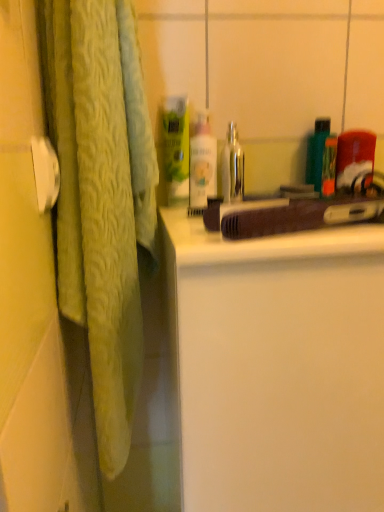
Describe the element at coordinates (277, 366) in the screenshot. Image resolution: width=384 pixels, height=512 pixels. I see `white matte cabinet at center` at that location.

What is the approximate width of shiny metallic faucet at center?

The width of shiny metallic faucet at center is 2.41 inches.

Locate an element on the screen. The width and height of the screenshot is (384, 512). shiny metallic faucet at center is located at coordinates (232, 167).

This screenshot has width=384, height=512. Describe the element at coordinates (215, 242) in the screenshot. I see `brown matte hairdryer at center` at that location.

Locate an element on the screen. Image resolution: width=384 pixels, height=512 pixels. brown matte hairdryer at center is located at coordinates (215, 242).

Where is `white matte cabinet at center`? The width and height of the screenshot is (384, 512). white matte cabinet at center is located at coordinates (277, 366).

Find the location of `bathroom cabinet directly beneath the green matte bottle at center (from a real-world perspective)`. bathroom cabinet directly beneath the green matte bottle at center (from a real-world perspective) is located at coordinates (277, 366).

Which is correct: white matte cabinet at center is inside green matte bottle at center, or outside of it?

white matte cabinet at center is not inside green matte bottle at center, it's outside.

Between point (205, 291) and point (167, 150), which one is positioned behind?

Point (167, 150)

How different are the orientations of white matte cabinet at center and green matte bottle at center in degrees?

The facing directions of white matte cabinet at center and green matte bottle at center are 6.66e-05 degrees apart.

Which is in front, brown matte hairdryer at center or shiny metallic faucet at center?

brown matte hairdryer at center is more forward.

Is brown matte hairdryer at center thinner than shiny metallic faucet at center?

No.

From the image's perspective, who appears lower, brown matte hairdryer at center or shiny metallic faucet at center?

brown matte hairdryer at center appears lower in the image.

Considering the relative sizes of brown matte hairdryer at center and shiny metallic faucet at center in the image provided, is brown matte hairdryer at center smaller than shiny metallic faucet at center?

No.

Considering the points (252, 206) and (280, 275), which point is in front, point (252, 206) or point (280, 275)?

Point (280, 275)

Which is more to the left, brown matte hairdryer at center or white matte cabinet at center?

From the viewer's perspective, brown matte hairdryer at center appears more on the left side.

From a real-world perspective, who is located lower, brown matte hairdryer at center or white matte cabinet at center?

white matte cabinet at center, from a real-world perspective.

Choose the correct answer: Is brown matte hairdryer at center inside white matte cabinet at center or outside it?

brown matte hairdryer at center is not inside white matte cabinet at center, it's outside.

Is white matte cabinet at center positioned with its back to shiny metallic faucet at center?

white matte cabinet at center does not have its back to shiny metallic faucet at center.

Consider the image. What's the angular difference between white matte cabinet at center and shiny metallic faucet at center's facing directions?

The angle between the facing direction of white matte cabinet at center and the facing direction of shiny metallic faucet at center is 3.25e-05 degrees.

Considering the positions of objects white matte cabinet at center and shiny metallic faucet at center in the image provided, who is more to the left, white matte cabinet at center or shiny metallic faucet at center?

shiny metallic faucet at center.

Which is correct: white matte cabinet at center is inside shiny metallic faucet at center, or outside of it?

white matte cabinet at center is spatially situated outside shiny metallic faucet at center.

Considering the sizes of objects shiny metallic faucet at center and white glossy lotion at center in the image provided, who is bigger, shiny metallic faucet at center or white glossy lotion at center?

With larger size is white glossy lotion at center.

Is shiny metallic faucet at center wider than white glossy lotion at center?

Correct, the width of shiny metallic faucet at center exceeds that of white glossy lotion at center.

Identify the location of toiletry lying in front of the shiny metallic faucet at center. (201, 163).

Based on the photo, is shiny metallic faucet at center not within white glossy lotion at center?

Absolutely, shiny metallic faucet at center is external to white glossy lotion at center.

Which is in front, shiny metallic faucet at center or brown matte hairdryer at center?

brown matte hairdryer at center is more forward.

How distant is shiny metallic faucet at center from brown matte hairdryer at center?

shiny metallic faucet at center and brown matte hairdryer at center are 7.88 inches apart from each other.

Considering the sizes of objects shiny metallic faucet at center and brown matte hairdryer at center in the image provided, who is thinner, shiny metallic faucet at center or brown matte hairdryer at center?

Thinner between the two is shiny metallic faucet at center.

From the picture: From the image's perspective, who appears lower, shiny metallic faucet at center or brown matte hairdryer at center?

brown matte hairdryer at center, from the image's perspective.

Is point (170, 106) farther from viewer compared to point (238, 150)?

No.

Identify the location of cleaning product that appears above the shiny metallic faucet at center (from a real-world perspective). The width and height of the screenshot is (384, 512). (175, 147).

Between green matte bottle at center and shiny metallic faucet at center, which one has larger width?

With larger width is shiny metallic faucet at center.

Are green matte bottle at center and shiny metallic faucet at center making contact?

Yes, green matte bottle at center is right next to shiny metallic faucet at center and making contact.

This screenshot has height=512, width=384. Find the location of `bathroom cabinet located on the right of green matte bottle at center`. bathroom cabinet located on the right of green matte bottle at center is located at coordinates (277, 366).

Where is `faucet located on the left of brown matte hairdryer at center`? faucet located on the left of brown matte hairdryer at center is located at coordinates (232, 167).

Looking at the image, which one is located further to white matte cabinet at center, white glossy lotion at center or shiny metallic faucet at center?

shiny metallic faucet at center is further to white matte cabinet at center.

Estimate the real-world distances between objects in this image. Which object is further from shiny metallic faucet at center, white glossy lotion at center or green matte bottle at center?

green matte bottle at center is further to shiny metallic faucet at center.

Which object lies further to the anchor point green matte bottle at center, shiny metallic faucet at center or white matte cabinet at center?

white matte cabinet at center is further to green matte bottle at center.

Looking at this image, looking at the image, which one is located further to white glossy lotion at center, white matte cabinet at center or green matte bottle at center?

The object further to white glossy lotion at center is white matte cabinet at center.

Based on their spatial positions, is shiny metallic faucet at center or white glossy lotion at center further from green matte bottle at center?

shiny metallic faucet at center lies further to green matte bottle at center than the other object.

Looking at the image, which one is located closer to shiny metallic faucet at center, brown matte hairdryer at center or white glossy lotion at center?

Based on the image, white glossy lotion at center appears to be nearer to shiny metallic faucet at center.

Consider the image. Estimate the real-world distances between objects in this image. Which object is closer to white matte cabinet at center, shiny metallic faucet at center or white glossy lotion at center?

white glossy lotion at center is closer to white matte cabinet at center.

Estimate the real-world distances between objects in this image. Which object is closer to white matte cabinet at center, white glossy lotion at center or green matte bottle at center?

The object closer to white matte cabinet at center is white glossy lotion at center.

At what (x,y) coordinates should I click in order to perform the action: click on cleaning product between brown matte hairdryer at center and white glossy lotion at center from front to back. Please return your answer as a coordinate pair (x, y). The height and width of the screenshot is (512, 384). Looking at the image, I should click on (175, 147).

Find the location of a particular element. Image resolution: width=384 pixels, height=512 pixels. counter top between shiny metallic faucet at center and white matte cabinet at center vertically is located at coordinates (215, 242).

Identify the location of toiletry between green matte bottle at center and white matte cabinet at center vertically. (201, 163).

Locate an element on the screen. The width and height of the screenshot is (384, 512). cleaning product located between brown matte hairdryer at center and shiny metallic faucet at center in the depth direction is located at coordinates (175, 147).